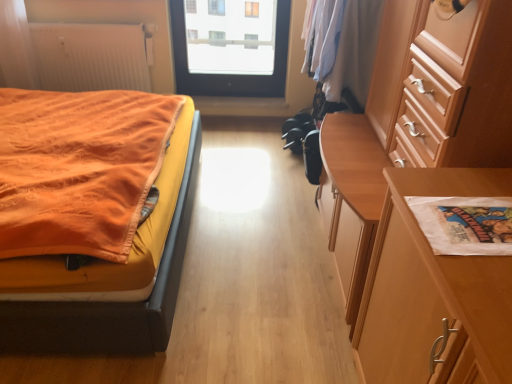
Locate an element on the screen. This screenshot has width=512, height=384. free space to the left of wooden chest of drawers at right is located at coordinates (250, 267).